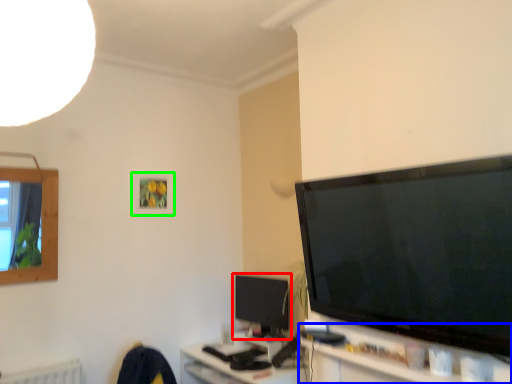
Question: Which object is positioned farthest from television (highlighted by a red box)? Select from tv cabinet (highlighted by a blue box) and picture frame (highlighted by a green box).

Choices:
 (A) tv cabinet
 (B) picture frame

Answer: (A)